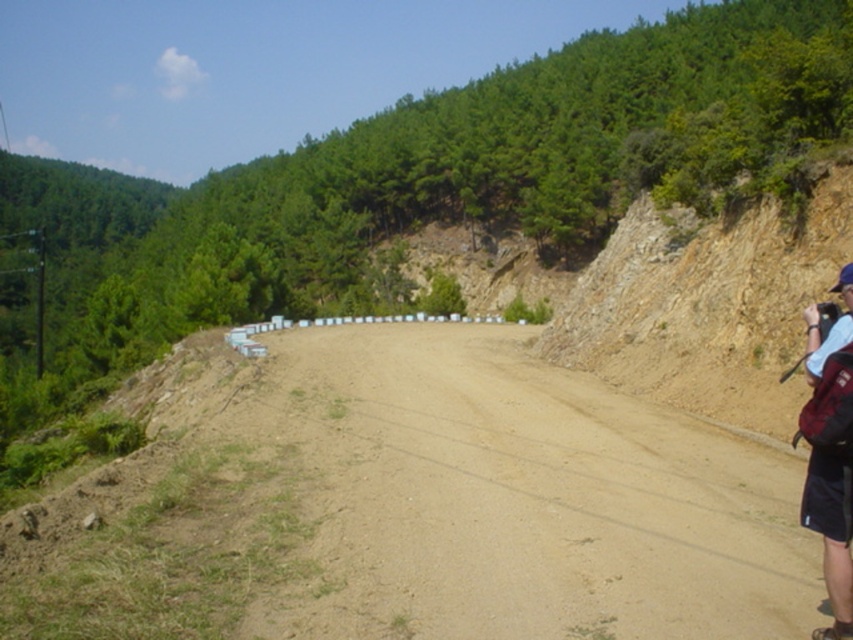
Question: Is brown sandy dirt track at center to the left of dark blue backpack at right from the viewer's perspective?

Choices:
 (A) yes
 (B) no

Answer: (A)

Question: Where is brown sandy dirt track at center located in relation to dark blue backpack at right in the image?

Choices:
 (A) right
 (B) left

Answer: (B)

Question: Does brown sandy dirt track at center have a smaller size compared to dark blue backpack at right?

Choices:
 (A) yes
 (B) no

Answer: (B)

Question: Which of the following is the closest to the observer?

Choices:
 (A) brown sandy dirt track at center
 (B) dark blue backpack at right

Answer: (B)

Question: Among these objects, which one is nearest to the camera?

Choices:
 (A) dark blue backpack at right
 (B) brown sandy dirt track at center

Answer: (A)